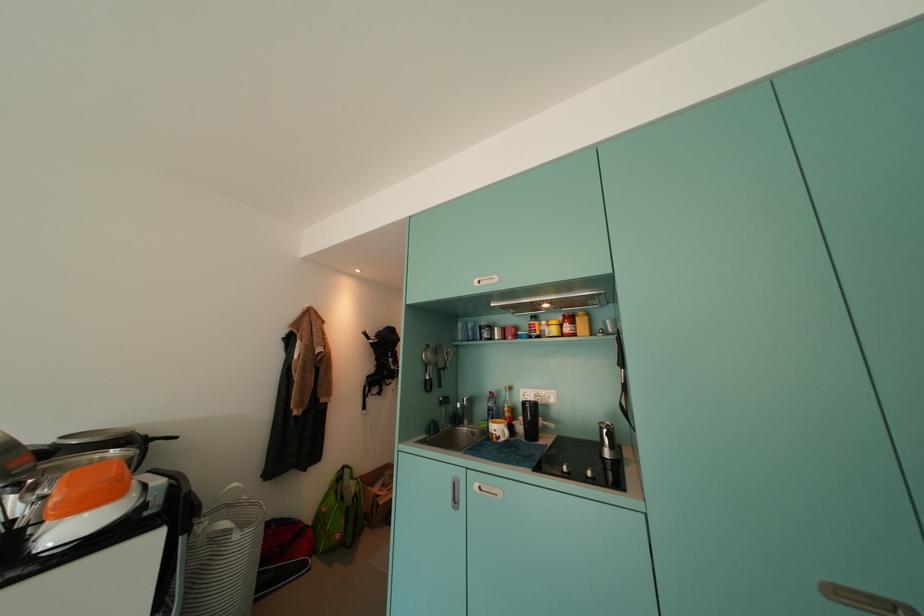
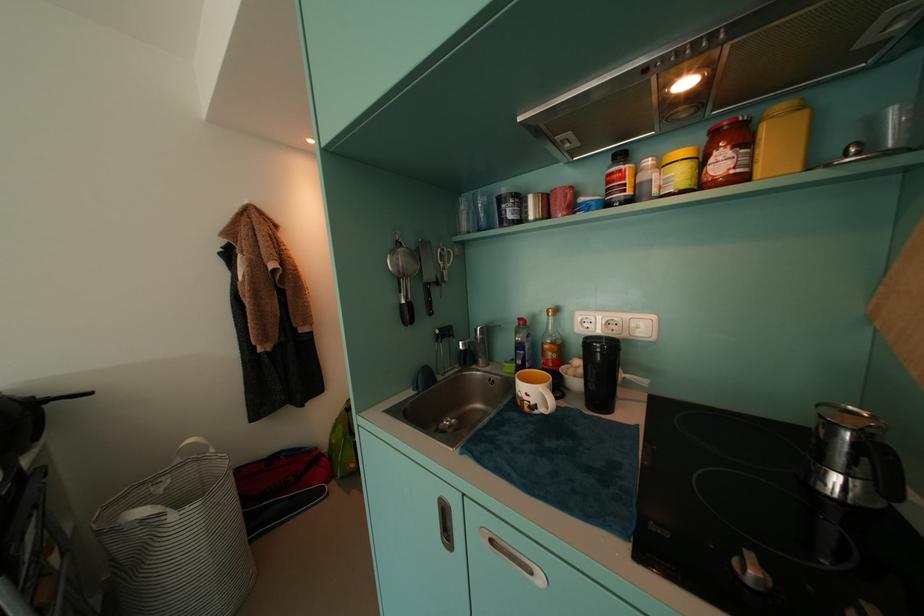
In the second image, find the point that corresponds to pixel 511 442 in the first image.

(550, 413)